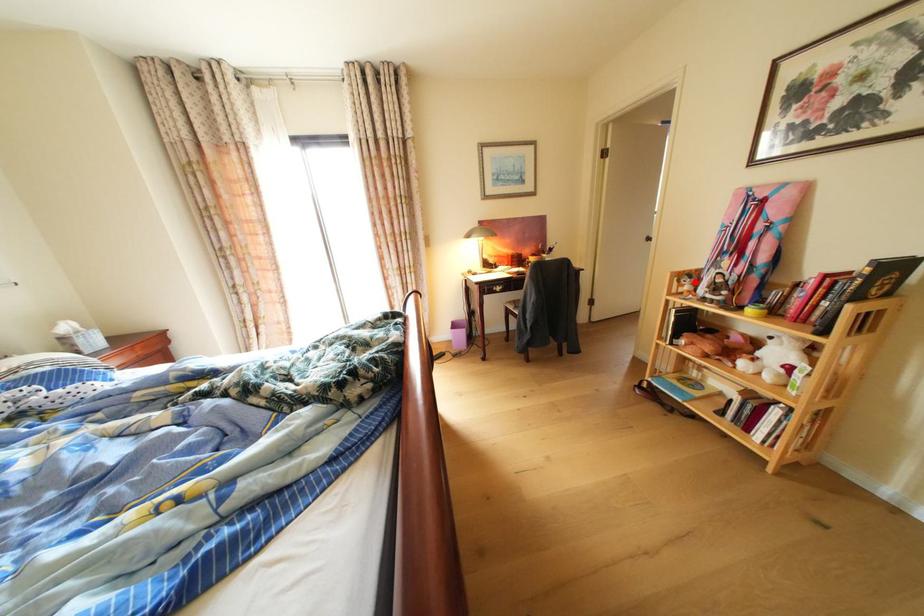
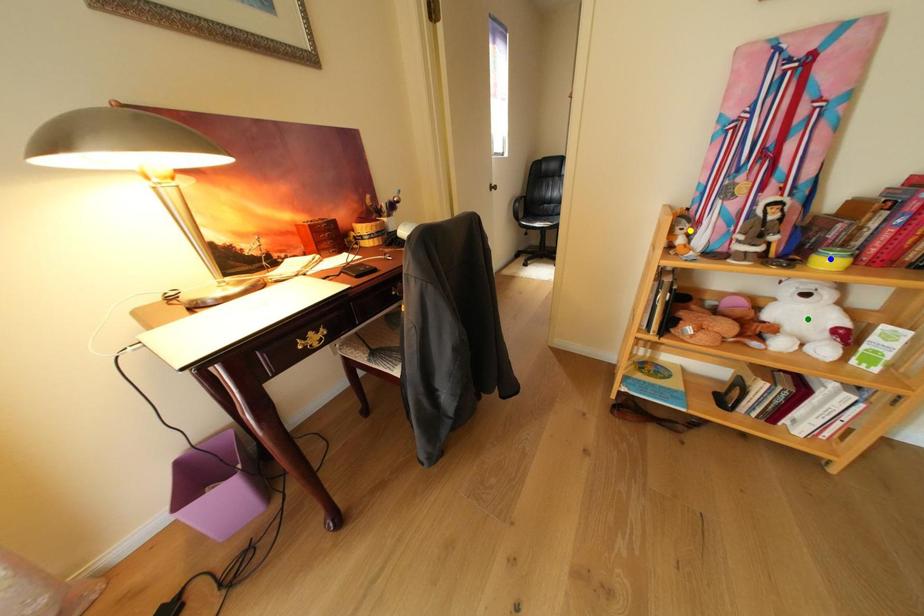
Question: I am providing you with two images of the same scene from different viewpoints. A red point is marked on the first image. You are given multiple points on the second image. Which point in image 2 represents the same 3d spot as the red point in image 1?

Choices:
 (A) yellow point
 (B) green point
 (C) blue point

Answer: (A)